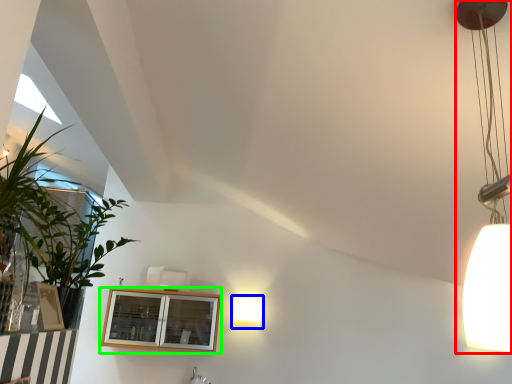
Question: Which object is the closest to the lamp (highlighted by a red box)? Choose among these: lamp (highlighted by a blue box) or window (highlighted by a green box).

Choices:
 (A) lamp
 (B) window

Answer: (B)